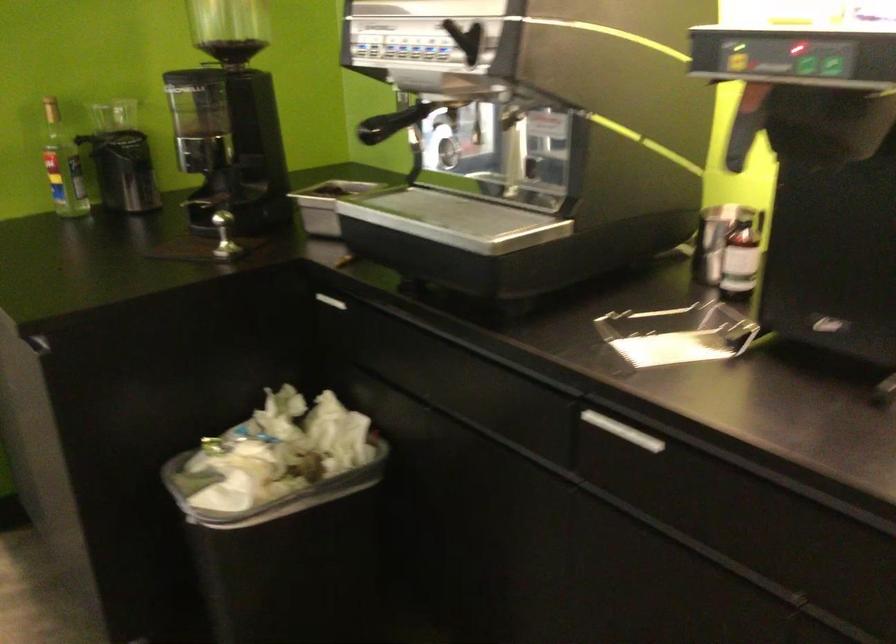
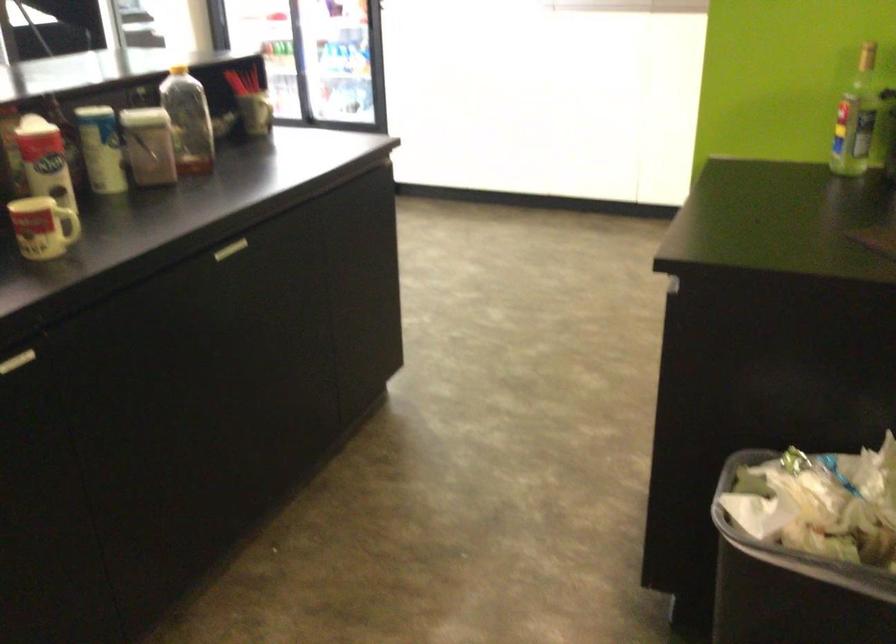
Locate, in the second image, the point that corresponds to pixel 93 171 in the first image.

(856, 118)